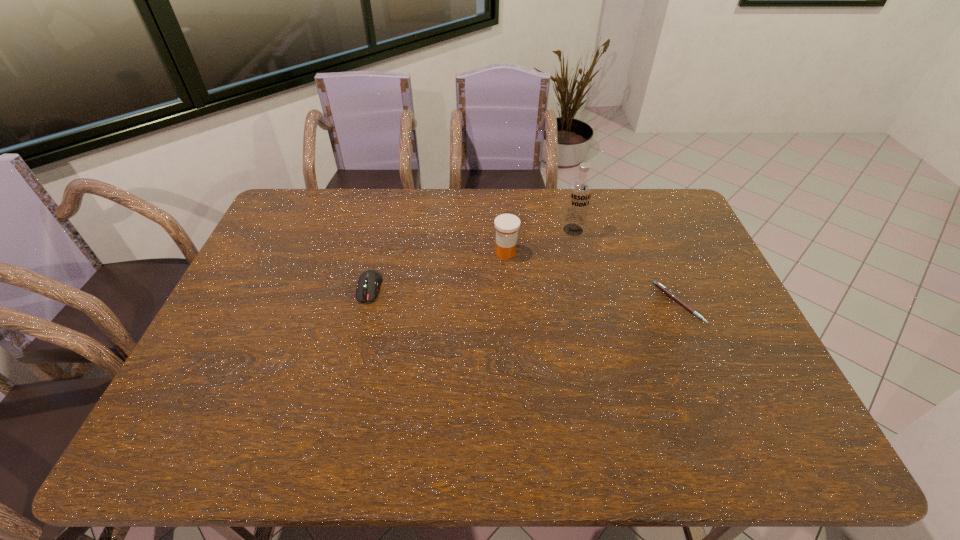
Where is `vacant space located 0.220m on the front label of the tallest object`? vacant space located 0.220m on the front label of the tallest object is located at coordinates (561, 281).

Where is `free space located 0.210m on the front label of the tallest object`? The width and height of the screenshot is (960, 540). free space located 0.210m on the front label of the tallest object is located at coordinates (562, 279).

Find the location of `vacant region located 0.100m on the front label of the tallest object`. vacant region located 0.100m on the front label of the tallest object is located at coordinates (566, 256).

Find the location of `vacant space positioned 0.250m on the label of the third nearest object`. vacant space positioned 0.250m on the label of the third nearest object is located at coordinates (464, 313).

Where is `free space located 0.400m on the label of the third nearest object`? free space located 0.400m on the label of the third nearest object is located at coordinates (437, 352).

I want to click on vacant space located 0.180m on the label of the third nearest object, so click(475, 297).

Locate an element on the screen. The height and width of the screenshot is (540, 960). object that is at the far edge is located at coordinates (580, 189).

This screenshot has width=960, height=540. I want to click on object located at the right edge, so click(x=669, y=293).

Where is `free space at the far edge of the desktop`? free space at the far edge of the desktop is located at coordinates pyautogui.click(x=460, y=189).

In the image, there is a desktop. At what (x,y) coordinates should I click in order to perform the action: click on vacant space at the near edge. Please return your answer as a coordinate pair (x, y). Looking at the image, I should click on pyautogui.click(x=633, y=393).